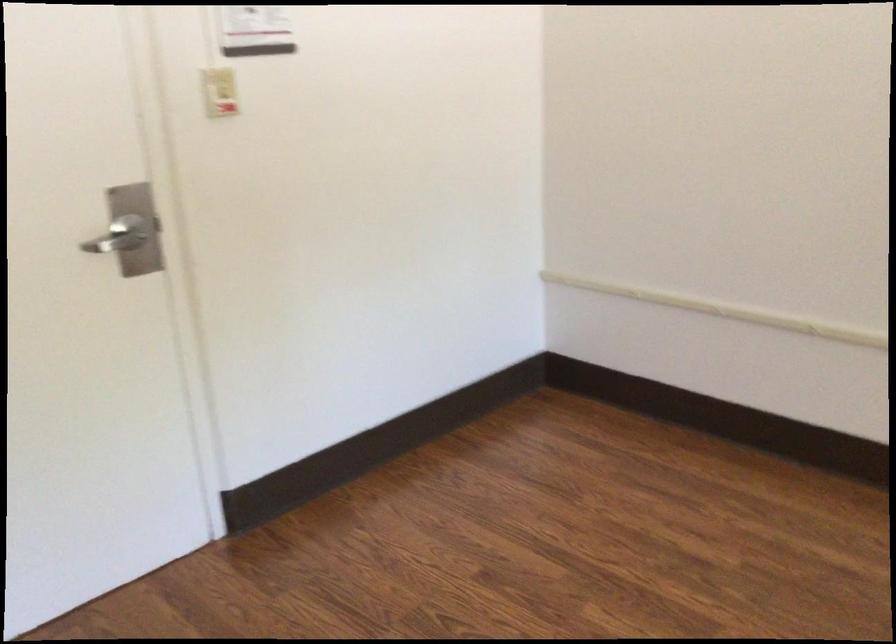
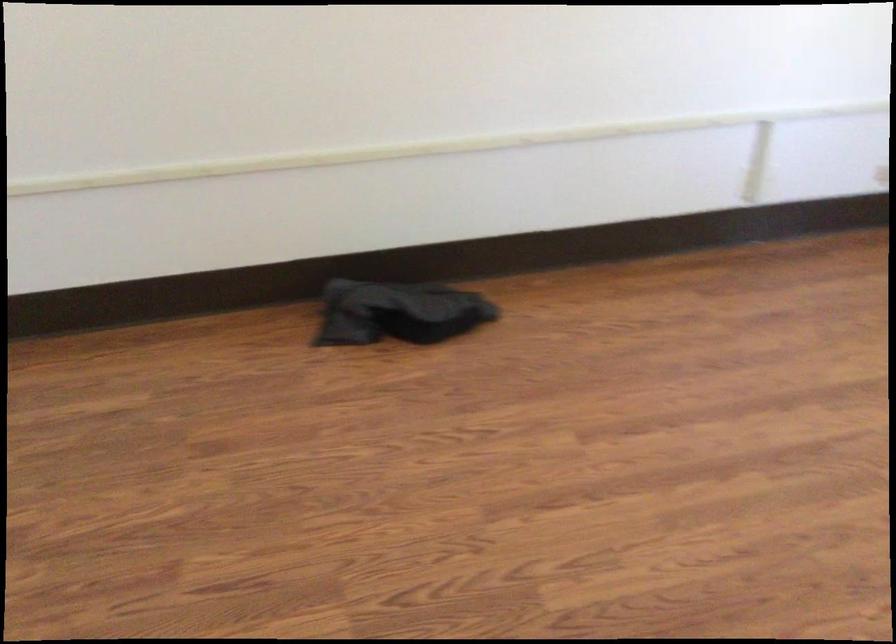
The first image is from the beginning of the video and the second image is from the end. How did the camera likely rotate when shooting the video?

The camera's rotation is toward right-down.